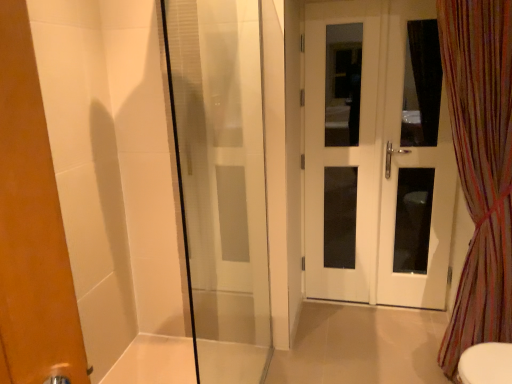
Locate an element on the screen. The height and width of the screenshot is (384, 512). free space below white glass door at right, the 1th screen door positioned from the right (from a real-world perspective) is located at coordinates (411, 319).